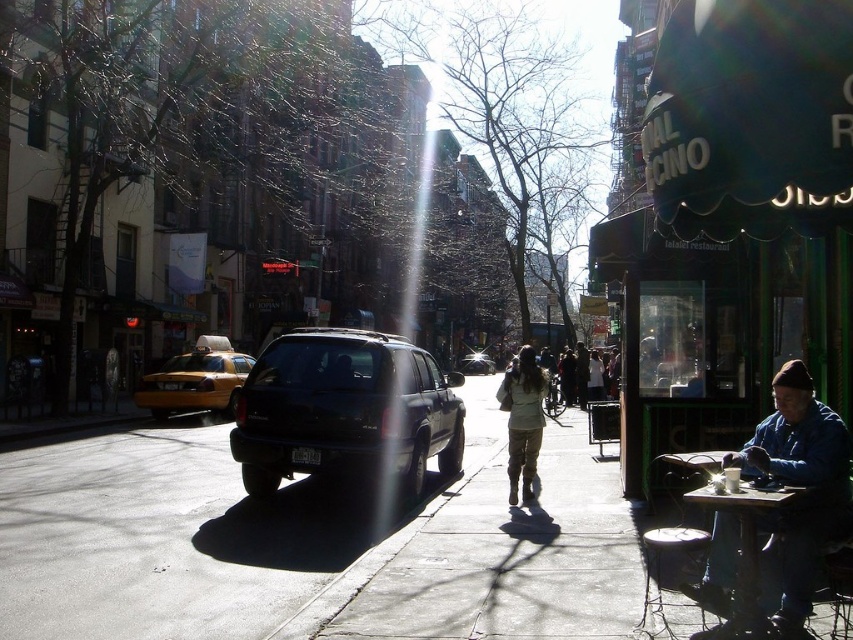
Question: Can you confirm if black matte suv at center is thinner than yellow matte taxi at left?

Choices:
 (A) no
 (B) yes

Answer: (A)

Question: Can you confirm if khaki cotton pants at center is wider than shiny black suv at center?

Choices:
 (A) yes
 (B) no

Answer: (B)

Question: Can you confirm if dark asphalt pavement at center is wider than yellow matte taxi at left?

Choices:
 (A) yes
 (B) no

Answer: (A)

Question: Which object appears farthest from the camera in this image?

Choices:
 (A) blue denim jacket at lower right
 (B) khaki cotton pants at center
 (C) black matte suv at center

Answer: (C)

Question: Which object appears closest to the camera in this image?

Choices:
 (A) yellow matte taxi at left
 (B) blue denim jacket at lower right

Answer: (B)

Question: Among these objects, which one is farthest from the camera?

Choices:
 (A) khaki cotton pants at center
 (B) black matte suv at center
 (C) dark asphalt pavement at center

Answer: (B)